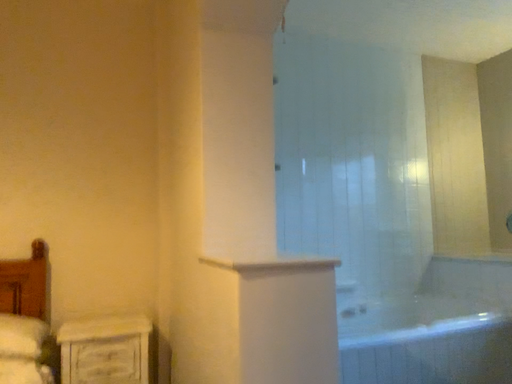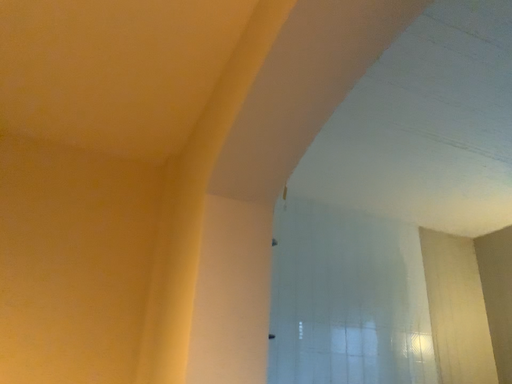
Question: How did the camera likely rotate when shooting the video?

Choices:
 (A) rotated upward
 (B) rotated downward

Answer: (A)